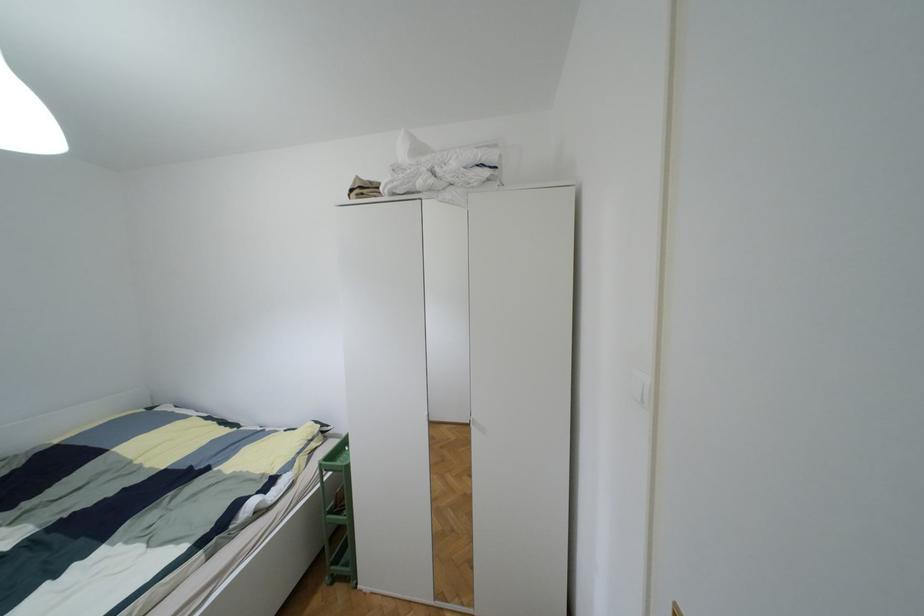
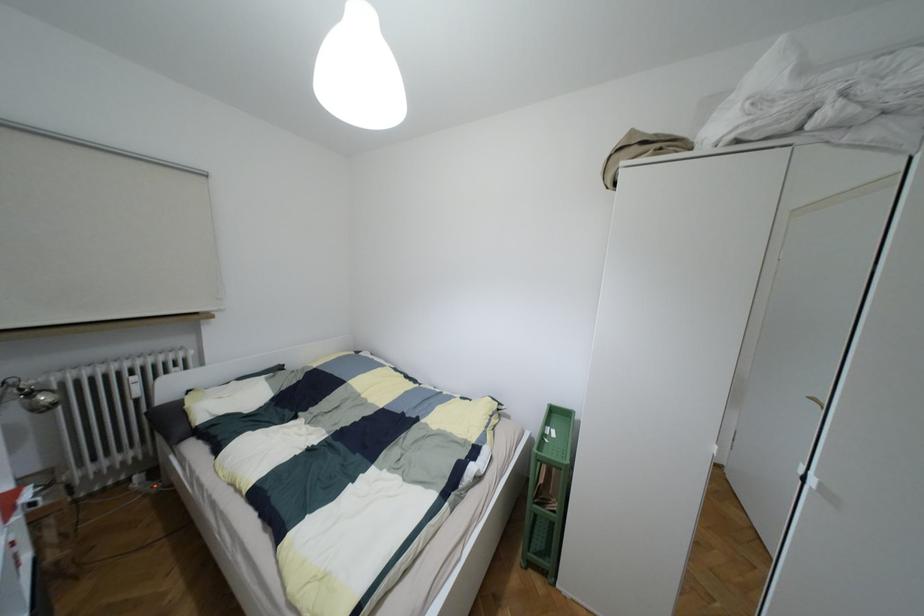
Question: Which direction would the cameraman need to move to produce the second image? Reply with the corresponding letter.

Choices:
 (A) Left
 (B) Right
 (C) Forward
 (D) Backward

Answer: (A)